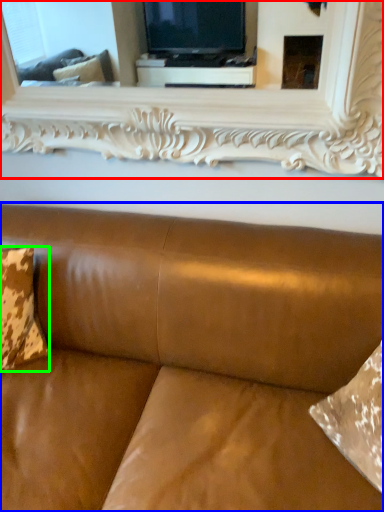
Question: Estimate the real-world distances between objects in this image. Which object is farther from mirror (highlighted by a red box), studio couch (highlighted by a blue box) or pillow (highlighted by a green box)?

Choices:
 (A) studio couch
 (B) pillow

Answer: (B)